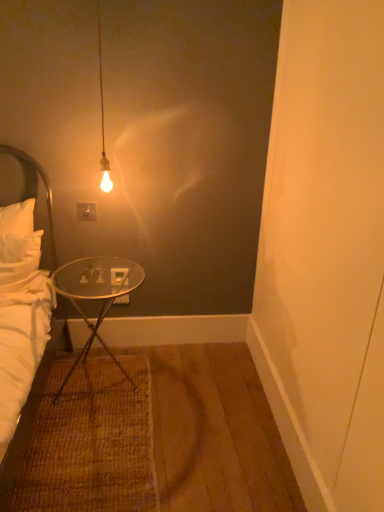
This screenshot has height=512, width=384. I want to click on white plastic power outlet at upper center, so click(x=86, y=211).

What do you see at coordinates (86, 211) in the screenshot? The width and height of the screenshot is (384, 512). I see `white plastic power outlet at upper center` at bounding box center [86, 211].

Locate an element on the screen. The width and height of the screenshot is (384, 512). white plastic power outlet at upper center is located at coordinates (86, 211).

Are white fabric headboard at left and transparent glass table at lower left located far from each other?

No, white fabric headboard at left is not far away from transparent glass table at lower left.

Does white fabric headboard at left turn towards transparent glass table at lower left?

No, white fabric headboard at left does not turn towards transparent glass table at lower left.

From the image's perspective, is white soft bed at left on top of white fabric headboard at left?

Incorrect, from the image's perspective, white soft bed at left is lower than white fabric headboard at left.

Can you confirm if white soft bed at left is taller than white fabric headboard at left?

Indeed, white soft bed at left has a greater height compared to white fabric headboard at left.

From a real-world perspective, which object rests below the other?

white soft bed at left is physically lower.

Can you tell me how much white soft bed at left and white fabric headboard at left differ in facing direction?

The angular difference between white soft bed at left and white fabric headboard at left is 0.28 degrees.

Is white fabric headboard at left not inside white plastic power outlet at upper center?

Absolutely, white fabric headboard at left is external to white plastic power outlet at upper center.

Locate an element on the screen. The height and width of the screenshot is (512, 384). power outlet behind the white fabric headboard at left is located at coordinates (86, 211).

Is white fabric headboard at left oriented towards white plastic power outlet at upper center?

No, white fabric headboard at left does not turn towards white plastic power outlet at upper center.

Is the depth of white fabric headboard at left greater than that of white plastic power outlet at upper center?

That is False.

Does transparent glass table at lower left have a lesser width compared to white plastic power outlet at upper center?

No, transparent glass table at lower left is not thinner than white plastic power outlet at upper center.

From the image's perspective, is transparent glass table at lower left beneath white plastic power outlet at upper center?

Yes.

Locate an element on the screen. power outlet that is above the transparent glass table at lower left (from the image's perspective) is located at coordinates (86, 211).

Considering the relative sizes of transparent glass table at lower left and white plastic power outlet at upper center in the image provided, is transparent glass table at lower left bigger than white plastic power outlet at upper center?

Correct, transparent glass table at lower left is larger in size than white plastic power outlet at upper center.

Is transparent glass table at lower left beside white soft bed at left?

No, transparent glass table at lower left is not beside white soft bed at left.

Is transparent glass table at lower left at the right side of white soft bed at left?

Indeed, transparent glass table at lower left is positioned on the right side of white soft bed at left.

Is transparent glass table at lower left turned away from white soft bed at left?

transparent glass table at lower left does not have its back to white soft bed at left.

From the picture: Considering the relative sizes of transparent glass table at lower left and white soft bed at left in the image provided, is transparent glass table at lower left bigger than white soft bed at left?

Correct, transparent glass table at lower left is larger in size than white soft bed at left.

Which object is positioned more to the right, white soft bed at left or transparent glass table at lower left?

transparent glass table at lower left is more to the right.

Identify the location of bed above the transparent glass table at lower left (from the image's perspective). (24, 284).

Who is shorter, white soft bed at left or transparent glass table at lower left?

Standing shorter between the two is transparent glass table at lower left.

Measure the distance from transparent glass table at lower left to white fabric headboard at left.

A distance of 34.07 centimeters exists between transparent glass table at lower left and white fabric headboard at left.

Is transparent glass table at lower left completely or partially outside of white fabric headboard at left?

Yes, transparent glass table at lower left is not within white fabric headboard at left.

Looking at this image, are transparent glass table at lower left and white fabric headboard at left located far from each other?

No, transparent glass table at lower left is not far from white fabric headboard at left.

Based on the photo, which of these two, transparent glass table at lower left or white fabric headboard at left, stands taller?

Standing taller between the two is white fabric headboard at left.

In order to click on desk located in front of the white fabric headboard at left in this screenshot , I will do `click(96, 295)`.

The width and height of the screenshot is (384, 512). In order to click on headboard above the white soft bed at left (from a real-world perspective) in this screenshot , I will do `click(44, 185)`.

Estimate the real-world distances between objects in this image. Which object is closer to white plastic power outlet at upper center, white soft bed at left or white fabric headboard at left?

white fabric headboard at left is closer to white plastic power outlet at upper center.

Looking at the image, which one is located closer to transparent glass table at lower left, white fabric headboard at left or white plastic power outlet at upper center?

white fabric headboard at left is closer to transparent glass table at lower left.

In the scene shown: Considering their positions, is white soft bed at left positioned closer to white fabric headboard at left than white plastic power outlet at upper center?

The object closer to white fabric headboard at left is white plastic power outlet at upper center.

Which object lies further to the anchor point transparent glass table at lower left, white plastic power outlet at upper center or white soft bed at left?

Among the two, white plastic power outlet at upper center is located further to transparent glass table at lower left.

Looking at the image, which one is located further to white fabric headboard at left, transparent glass table at lower left or white soft bed at left?

transparent glass table at lower left lies further to white fabric headboard at left than the other object.

Considering their positions, is white plastic power outlet at upper center positioned closer to transparent glass table at lower left than white fabric headboard at left?

white fabric headboard at left lies closer to transparent glass table at lower left than the other object.

Which object lies nearer to the anchor point white fabric headboard at left, white soft bed at left or transparent glass table at lower left?

white soft bed at left is positioned closer to the anchor white fabric headboard at left.

From the image, which object appears to be farther from white soft bed at left, transparent glass table at lower left or white plastic power outlet at upper center?

white plastic power outlet at upper center is further to white soft bed at left.

Where is `headboard between white soft bed at left and white plastic power outlet at upper center in the front-back direction`? The width and height of the screenshot is (384, 512). headboard between white soft bed at left and white plastic power outlet at upper center in the front-back direction is located at coordinates (44, 185).

The height and width of the screenshot is (512, 384). I want to click on bed between white fabric headboard at left and transparent glass table at lower left in the horizontal direction, so click(x=24, y=284).

What are the coordinates of `headboard between white plastic power outlet at upper center and transparent glass table at lower left in the up-down direction` in the screenshot? It's located at (44, 185).

Find the location of a particular element. desk located between white soft bed at left and white plastic power outlet at upper center in the depth direction is located at coordinates (96, 295).